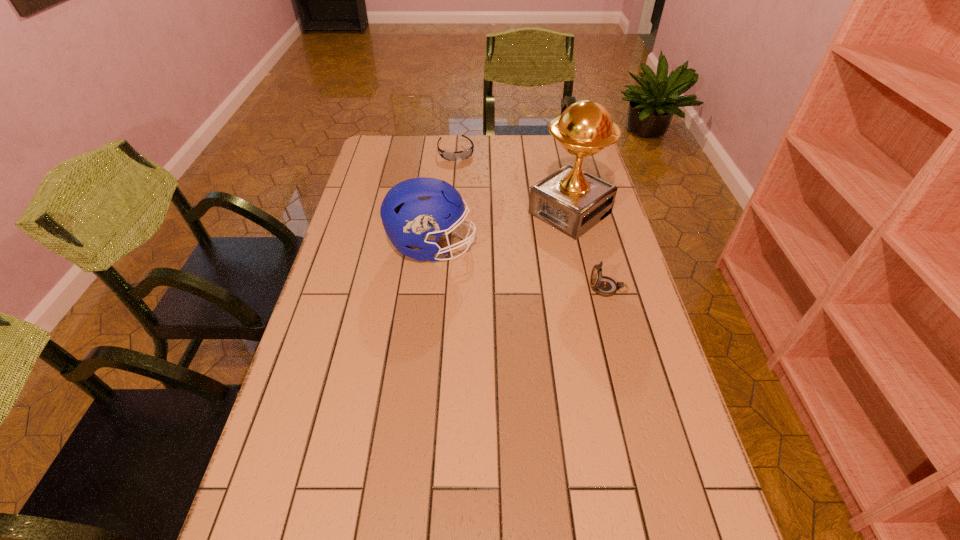
The image size is (960, 540). I want to click on free location located 0.370m on the front-facing side of the tallest object, so click(x=461, y=291).

You are a GUI agent. You are given a task and a screenshot of the screen. Output one action in this format:
    pyautogui.click(x=<x>, y=<y>)
    Task: Click on the vacant space positioned on the front-facing side of the tallest object
    The image size is (960, 540).
    Given the screenshot: What is the action you would take?
    pyautogui.click(x=499, y=264)

Where is `vacant space located 0.250m on the front-facing side of the tallest object`? The width and height of the screenshot is (960, 540). vacant space located 0.250m on the front-facing side of the tallest object is located at coordinates coord(490,270).

The image size is (960, 540). What are the coordinates of `vacant space located 0.240m on the lenses of the sunglasses` in the screenshot? It's located at (475, 197).

The image size is (960, 540). Identify the location of vacant space located 0.250m on the lenses of the sunglasses. (476, 199).

Locate an element on the screen. Image resolution: width=960 pixels, height=540 pixels. free location located on the lenses of the sunglasses is located at coordinates (474, 195).

Where is `object present at the far edge`? This screenshot has width=960, height=540. object present at the far edge is located at coordinates (450, 156).

The width and height of the screenshot is (960, 540). Find the location of `object present at the left edge`. object present at the left edge is located at coordinates (416, 212).

Where is `compass situated at the right edge`? This screenshot has width=960, height=540. compass situated at the right edge is located at coordinates (605, 286).

At what (x,y) coordinates should I click in order to perform the action: click on award that is at the right edge. Please return your answer as a coordinate pair (x, y). Looking at the image, I should click on (571, 200).